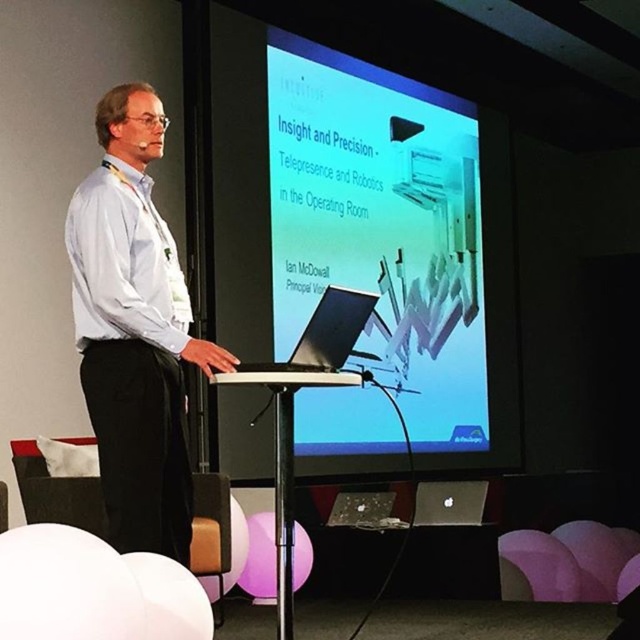
Looking at this image, does white plastic podium at center appear over sleek silver laptop at center?

No.

Does white plastic podium at center come in front of sleek silver laptop at center?

Yes, it is.

This screenshot has height=640, width=640. What do you see at coordinates (285, 464) in the screenshot?
I see `white plastic podium at center` at bounding box center [285, 464].

Locate an element on the screen. This screenshot has height=640, width=640. white plastic podium at center is located at coordinates (285, 464).

Is the position of light blue shirt at center more distant than that of white smooth shirt at left?

Yes, it is.

Between point (118, 160) and point (134, 326), which one is positioned in front?

Positioned in front is point (134, 326).

Who is more forward, (x=179, y=278) or (x=104, y=205)?

Point (x=104, y=205) is more forward.

In order to click on light blue shirt at center in this screenshot , I will do `click(134, 330)`.

Measure the distance from white glossy projector screen at upper center to white plastic podium at center.

white glossy projector screen at upper center is 3.51 meters from white plastic podium at center.

Which of these two, white glossy projector screen at upper center or white plastic podium at center, stands shorter?

white plastic podium at center is shorter.

Which is behind, point (368, 360) or point (243, 384)?

Point (368, 360)

At what (x,y) coordinates should I click in order to perform the action: click on white glossy projector screen at upper center. Please return your answer as a coordinate pair (x, y). This screenshot has height=640, width=640. Looking at the image, I should click on (381, 227).